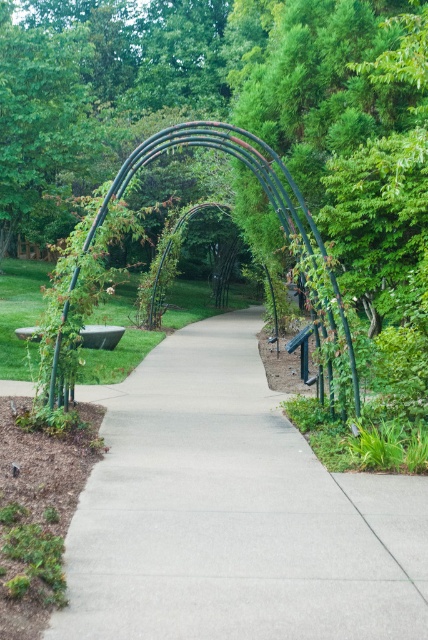
Can you confirm if green metal archway at center is positioned to the left of black metal archway at center?

Incorrect, green metal archway at center is not on the left side of black metal archway at center.

Which is behind, point (338, 304) or point (189, 250)?

Point (189, 250)

Where is `green metal archway at center`? green metal archway at center is located at coordinates (253, 173).

Does concrete at center appear on the right side of black metal archway at center?

Yes, concrete at center is to the right of black metal archway at center.

Find the location of `concrete at center`. concrete at center is located at coordinates (232, 513).

Which is above, concrete at center or green metal archway at center?

green metal archway at center is higher up.

Is concrete at center taller than green metal archway at center?

No, concrete at center is not taller than green metal archway at center.

Describe the element at coordinates (232, 513) in the screenshot. I see `concrete at center` at that location.

Identify the location of concrete at center. (232, 513).